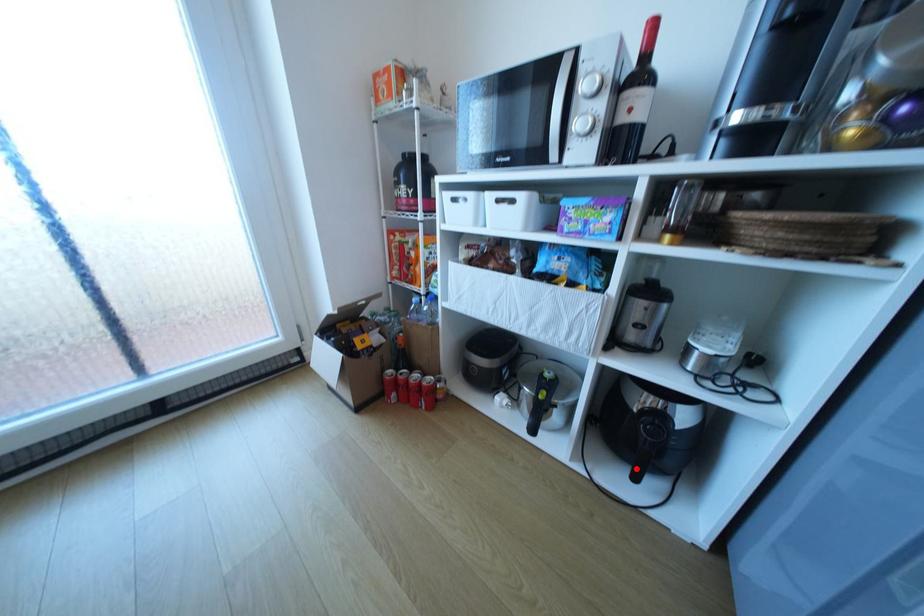
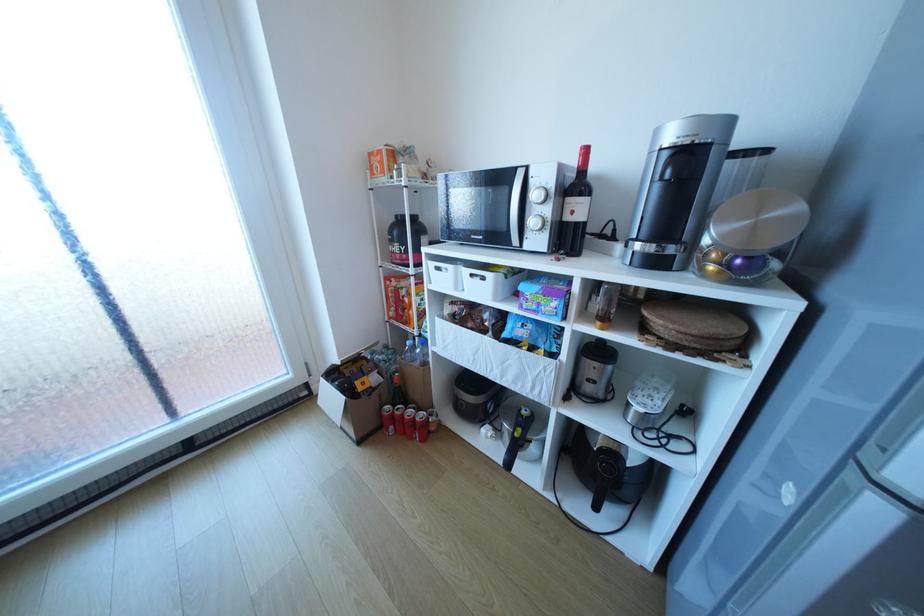
Locate, in the second image, the point that corresponds to the highlighted location in the first image.

(599, 499)